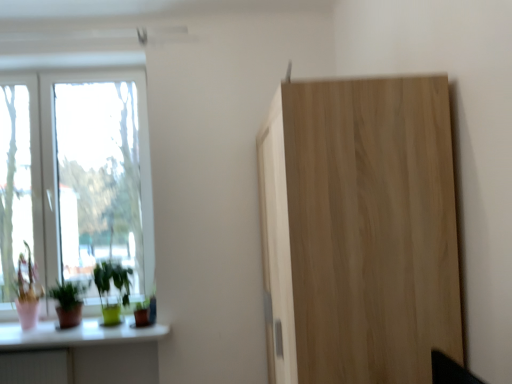
Identify the location of vacant area situated below green matte plant at lower left, the second houseplant positioned from the right (from a real-world perspective). (68, 330).